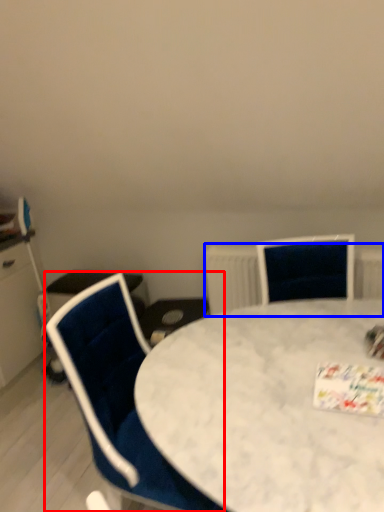
Question: Which object appears farthest to the camera in this image, chair (highlighted by a red box) or radiator (highlighted by a blue box)?

Choices:
 (A) chair
 (B) radiator

Answer: (B)